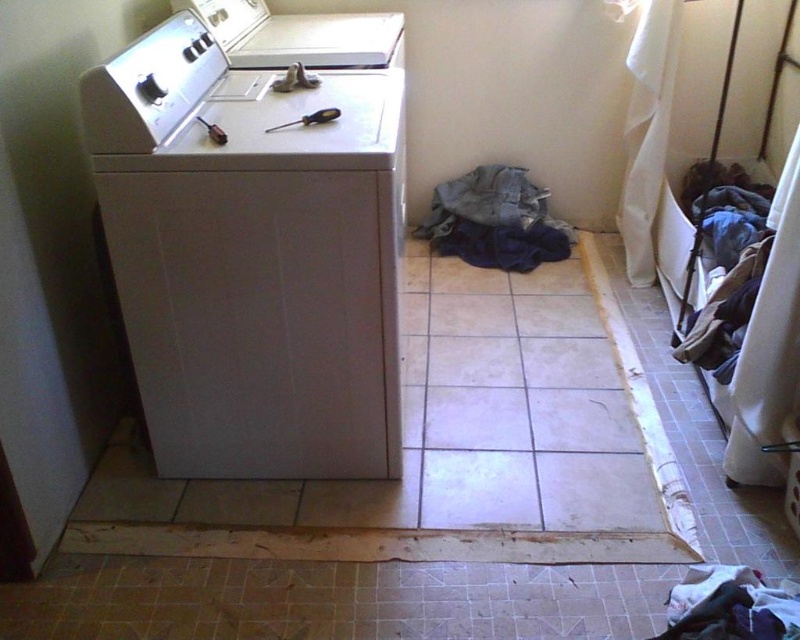
Question: Based on their relative distances, which object is farther from the fuzzy white laundry at lower right?

Choices:
 (A) white plastic washing machine at left
 (B) faded denim jacket at lower center

Answer: (B)

Question: Does faded denim jacket at lower center have a greater width compared to white glossy washing machine at center?

Choices:
 (A) no
 (B) yes

Answer: (A)

Question: Which point is closer to the camera?

Choices:
 (A) (764, 621)
 (B) (374, 348)
 (C) (468, 177)

Answer: (A)

Question: Considering the real-world distances, which object is farthest from the faded denim jacket at lower center?

Choices:
 (A) fuzzy white laundry at lower right
 (B) white plastic washing machine at left
 (C) white glossy washing machine at center

Answer: (A)

Question: Is white glossy washing machine at center further to the viewer compared to fuzzy white laundry at lower right?

Choices:
 (A) yes
 (B) no

Answer: (A)

Question: From the image, what is the correct spatial relationship of faded denim jacket at lower center in relation to fuzzy white laundry at lower right?

Choices:
 (A) above
 (B) below

Answer: (A)